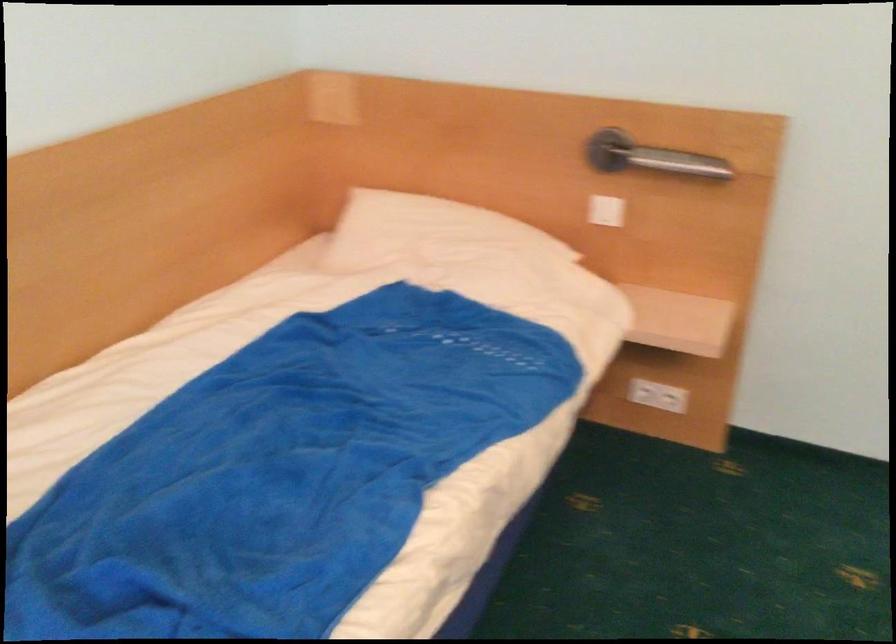
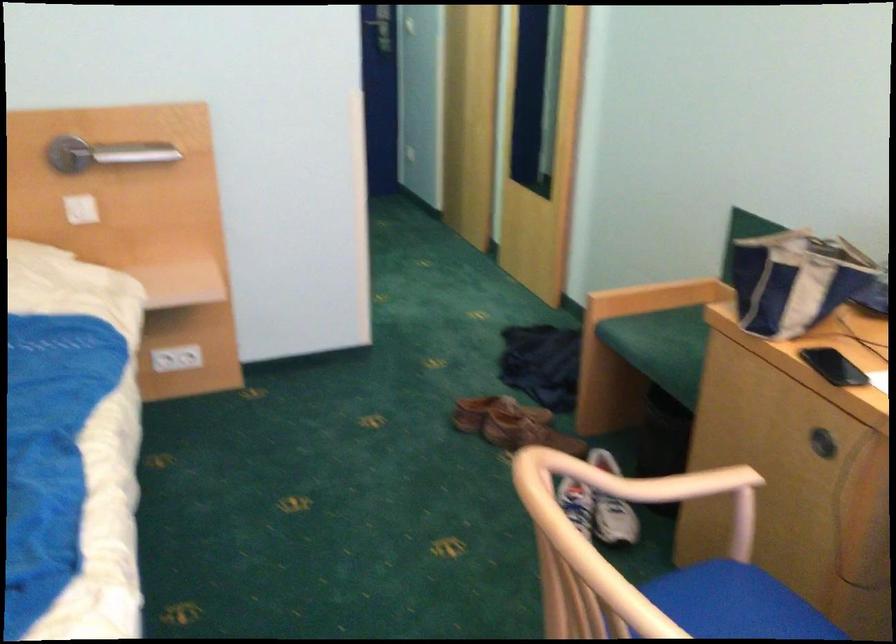
Where in the second image is the point corresponding to [659,393] from the first image?

(176, 359)